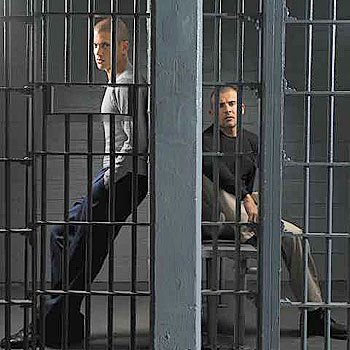
At what (x,y) coordinates should I click in order to perform the action: click on divider. Please return your answer as a coordinate pair (x, y). The width and height of the screenshot is (350, 350). Looking at the image, I should click on (186, 235).